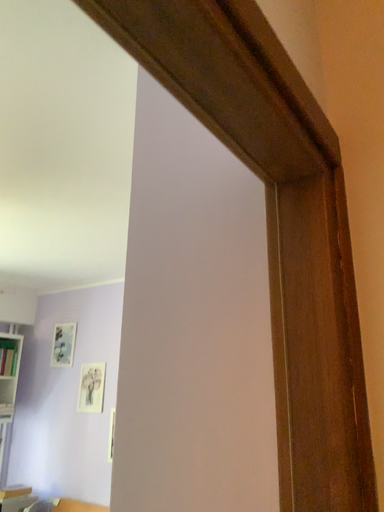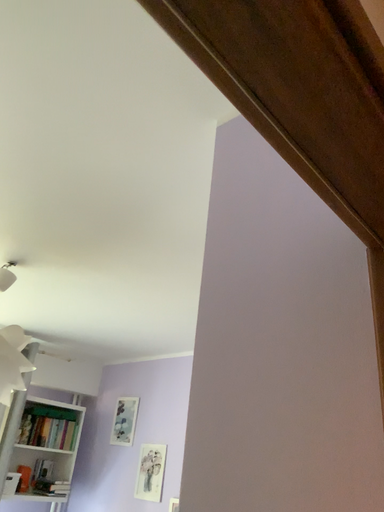
Question: Which way did the camera rotate in the video?

Choices:
 (A) rotated left
 (B) rotated right

Answer: (A)